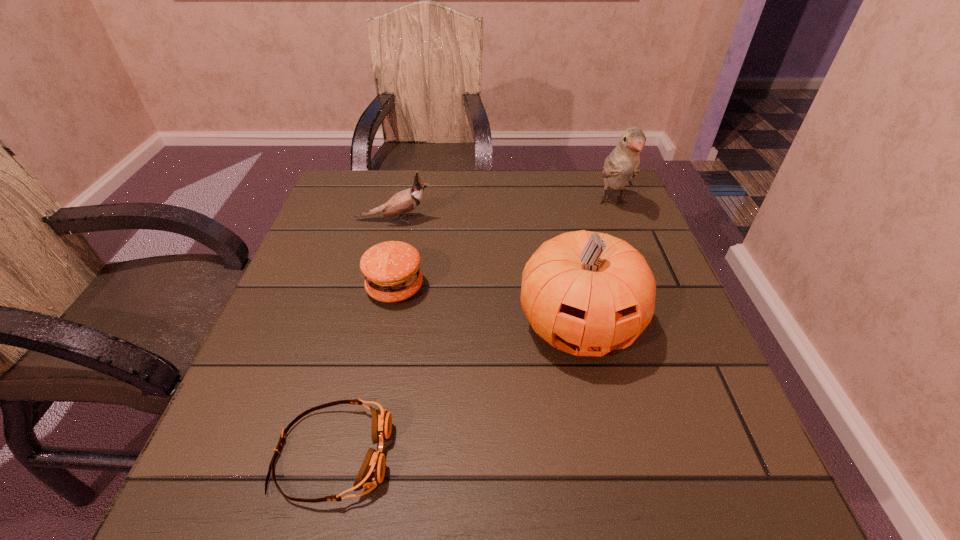
Identify the location of free location that satisfies the following two spatial constraints: 1. on the front-facing side of the pumpkin; 2. with the lenses facing forward on the goggles. (606, 454).